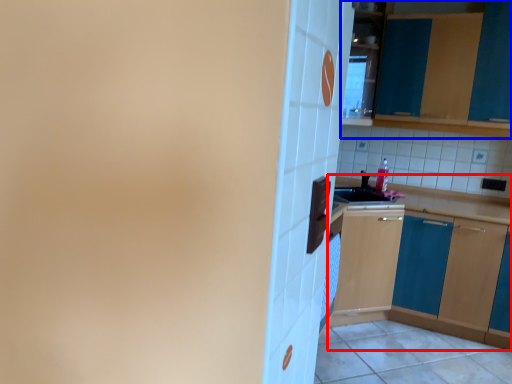
Question: Among these objects, which one is farthest to the camera, cabinetry (highlighted by a red box) or cabinetry (highlighted by a blue box)?

Choices:
 (A) cabinetry
 (B) cabinetry

Answer: (B)